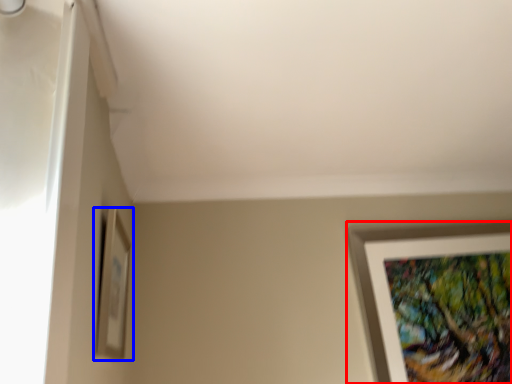
Question: Among these objects, which one is nearest to the camera, picture frame (highlighted by a red box) or picture frame (highlighted by a blue box)?

Choices:
 (A) picture frame
 (B) picture frame

Answer: (B)